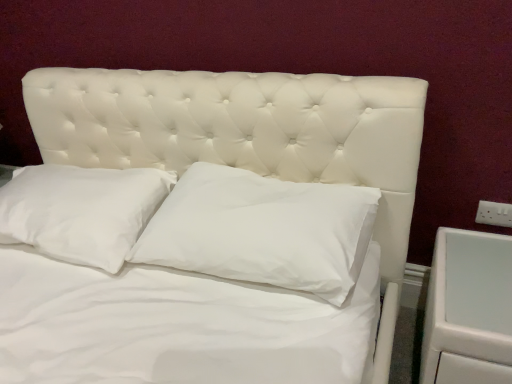
Question: Is white soft pillow at center, arranged as the 2th pillow when viewed from the right, taller than white cotton pillow at center, which ranks as the first pillow in right-to-left order?

Choices:
 (A) yes
 (B) no

Answer: (B)

Question: Can you confirm if white soft pillow at center, arranged as the 2th pillow when viewed from the right, is thinner than white cotton pillow at center, which ranks as the first pillow in right-to-left order?

Choices:
 (A) no
 (B) yes

Answer: (A)

Question: From a real-world perspective, is white soft pillow at center, arranged as the 2th pillow when viewed from the right, over white cotton pillow at center, which ranks as the first pillow in right-to-left order?

Choices:
 (A) no
 (B) yes

Answer: (A)

Question: Can you confirm if white soft pillow at center, acting as the 1th pillow starting from the left, is shorter than white cotton pillow at center, which ranks as the first pillow in right-to-left order?

Choices:
 (A) yes
 (B) no

Answer: (A)

Question: From a real-world perspective, is white soft pillow at center, acting as the 1th pillow starting from the left, under white cotton pillow at center, which is the second pillow from left to right?

Choices:
 (A) yes
 (B) no

Answer: (A)

Question: From the image's perspective, does white soft pillow at center, acting as the 1th pillow starting from the left, appear higher than white cotton pillow at center, which ranks as the first pillow in right-to-left order?

Choices:
 (A) no
 (B) yes

Answer: (B)

Question: Does white soft pillow at center, acting as the 1th pillow starting from the left, have a greater width compared to white glossy drawer at right?

Choices:
 (A) no
 (B) yes

Answer: (A)

Question: Is white soft pillow at center, arranged as the 2th pillow when viewed from the right, not within white glossy drawer at right?

Choices:
 (A) yes
 (B) no

Answer: (A)

Question: From a real-world perspective, does white soft pillow at center, arranged as the 2th pillow when viewed from the right, sit lower than white glossy drawer at right?

Choices:
 (A) no
 (B) yes

Answer: (A)

Question: Does white soft pillow at center, arranged as the 2th pillow when viewed from the right, appear on the right side of white glossy drawer at right?

Choices:
 (A) no
 (B) yes

Answer: (A)

Question: Is white soft pillow at center, arranged as the 2th pillow when viewed from the right, bigger than white glossy drawer at right?

Choices:
 (A) yes
 (B) no

Answer: (B)

Question: Can you confirm if white soft pillow at center, acting as the 1th pillow starting from the left, is smaller than white glossy drawer at right?

Choices:
 (A) yes
 (B) no

Answer: (A)

Question: Is white soft pillow at center, acting as the 1th pillow starting from the left, facing towards white plastic electric outlet at right?

Choices:
 (A) no
 (B) yes

Answer: (A)